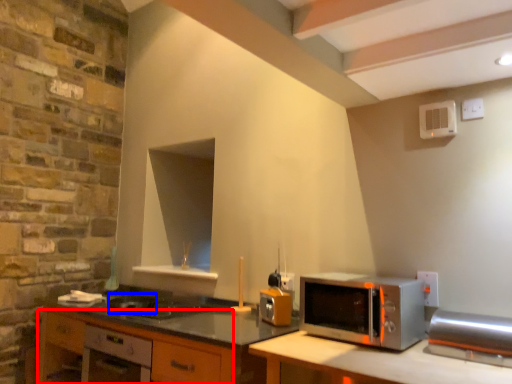
Question: Among these objects, which one is nearest to the camera, cabinetry (highlighted by a red box) or appliance (highlighted by a blue box)?

Choices:
 (A) cabinetry
 (B) appliance

Answer: (A)